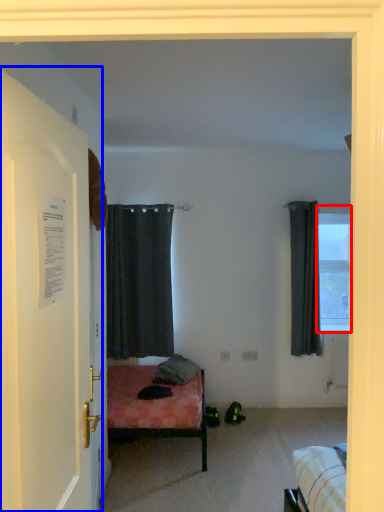
Question: Among these objects, which one is nearest to the camera, window (highlighted by a red box) or door (highlighted by a blue box)?

Choices:
 (A) window
 (B) door

Answer: (B)